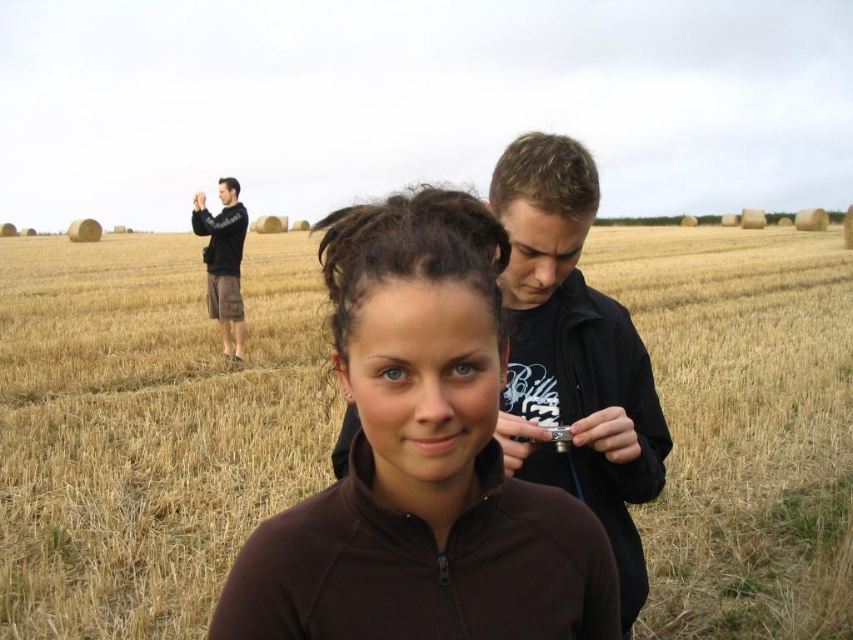
Question: Which of the following is the farthest from the observer?

Choices:
 (A) brown fleece jacket at center
 (B) yellow straw field at center
 (C) black cotton shorts at left
 (D) black matte jacket at center

Answer: (C)

Question: Is black matte jacket at center smaller than black cotton shorts at left?

Choices:
 (A) no
 (B) yes

Answer: (B)

Question: Among these points, which one is farthest from the camera?

Choices:
 (A) (610, 321)
 (B) (583, 612)
 (C) (125, 452)
 (D) (231, 340)

Answer: (D)

Question: Which object is the closest to the brown fleece jacket at center?

Choices:
 (A) yellow straw field at center
 (B) black matte jacket at center

Answer: (B)

Question: Is yellow straw field at center to the left of black cotton shorts at left from the viewer's perspective?

Choices:
 (A) yes
 (B) no

Answer: (B)

Question: Does yellow straw field at center appear on the right side of black cotton shorts at left?

Choices:
 (A) no
 (B) yes

Answer: (B)